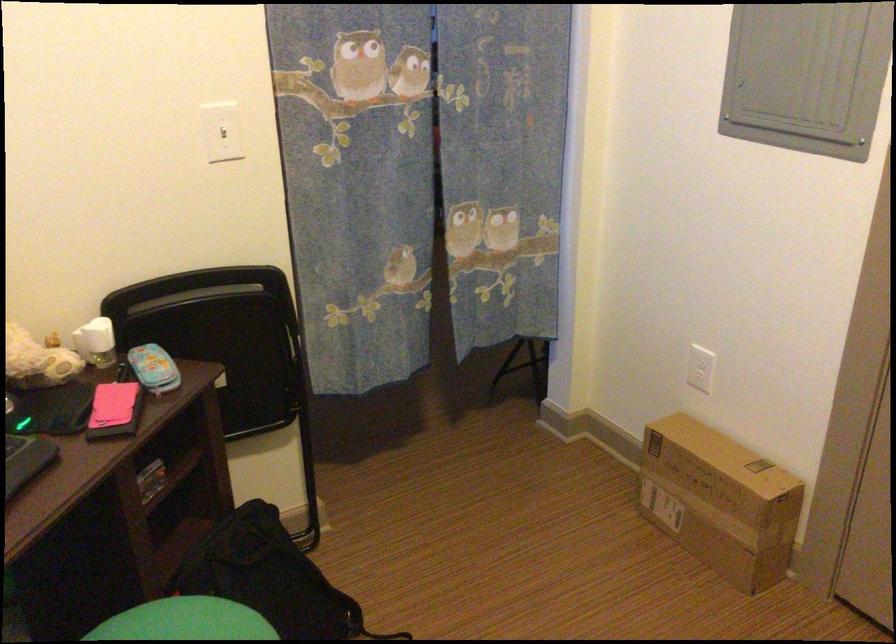
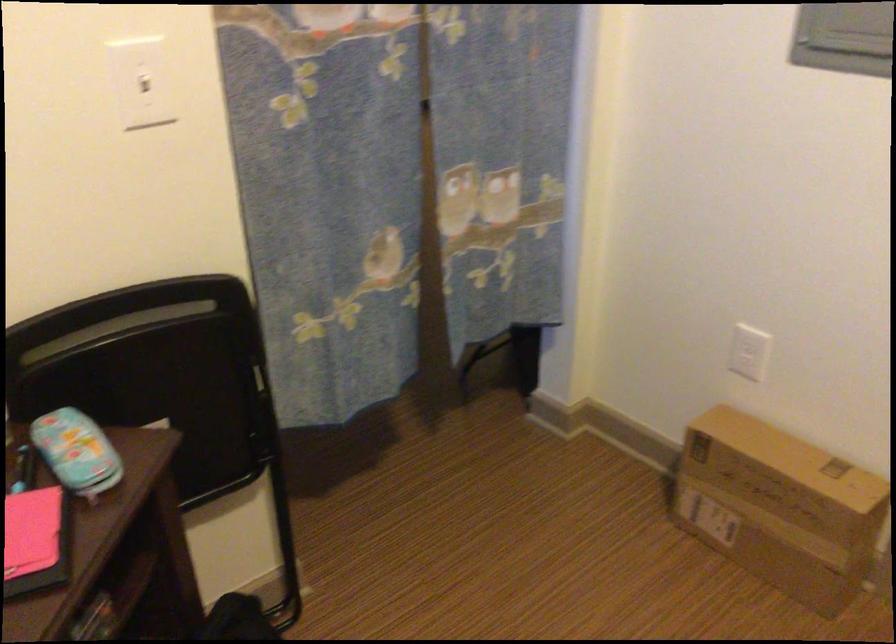
Question: How did the camera likely rotate?

Choices:
 (A) Left
 (B) Right
 (C) Up
 (D) Down

Answer: (B)